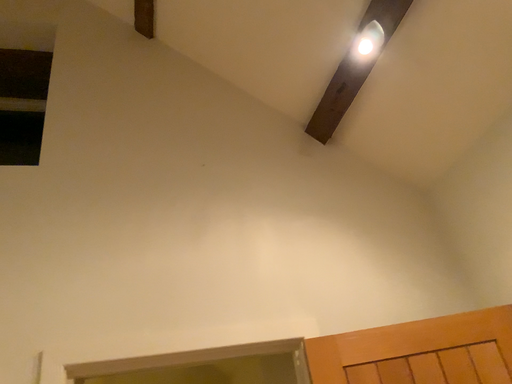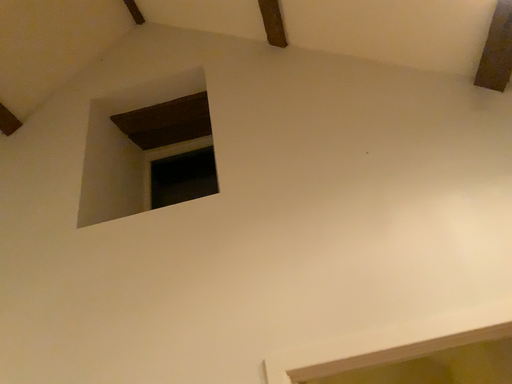
Question: Which way did the camera rotate in the video?

Choices:
 (A) rotated left
 (B) rotated right

Answer: (A)